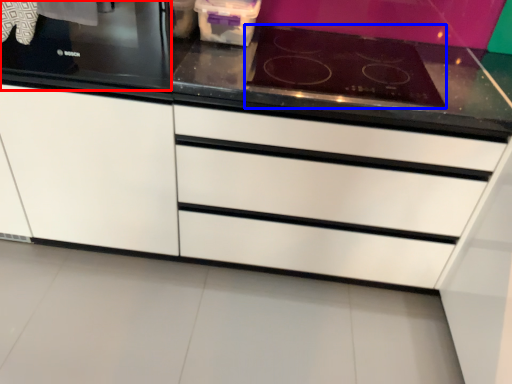
Question: Which point is further to the camera, home appliance (highlighted by a red box) or gas stove (highlighted by a blue box)?

Choices:
 (A) home appliance
 (B) gas stove

Answer: (B)